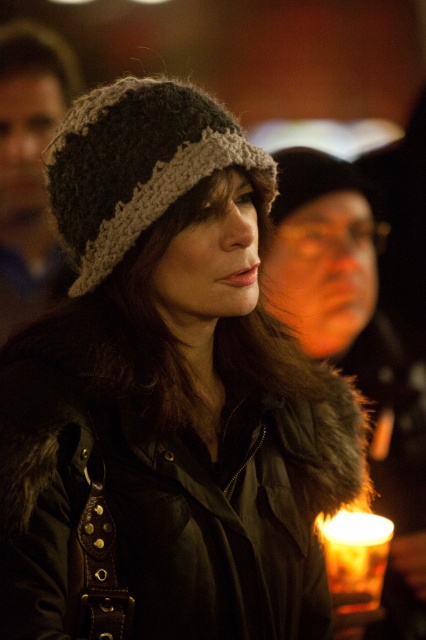
Question: Considering the real-world distances, which object is farthest from the knitted woolen hat at center?

Choices:
 (A) fuzzy knit hat at center
 (B) translucent glass candle at lower right

Answer: (A)

Question: Based on their relative distances, which object is farther from the fuzzy knit hat at center?

Choices:
 (A) translucent glass candle at lower right
 (B) knitted woolen hat at center

Answer: (A)

Question: Can you confirm if knitted woolen hat at center is positioned to the left of fuzzy knit hat at center?

Choices:
 (A) no
 (B) yes

Answer: (B)

Question: Which point appears farthest from the camera in this image?

Choices:
 (A) (155, 200)
 (B) (371, 188)

Answer: (B)

Question: Can you confirm if translucent glass candle at lower right is smaller than fuzzy knit hat at center?

Choices:
 (A) yes
 (B) no

Answer: (A)

Question: Is knitted woolen hat at center smaller than translucent glass candle at lower right?

Choices:
 (A) yes
 (B) no

Answer: (A)